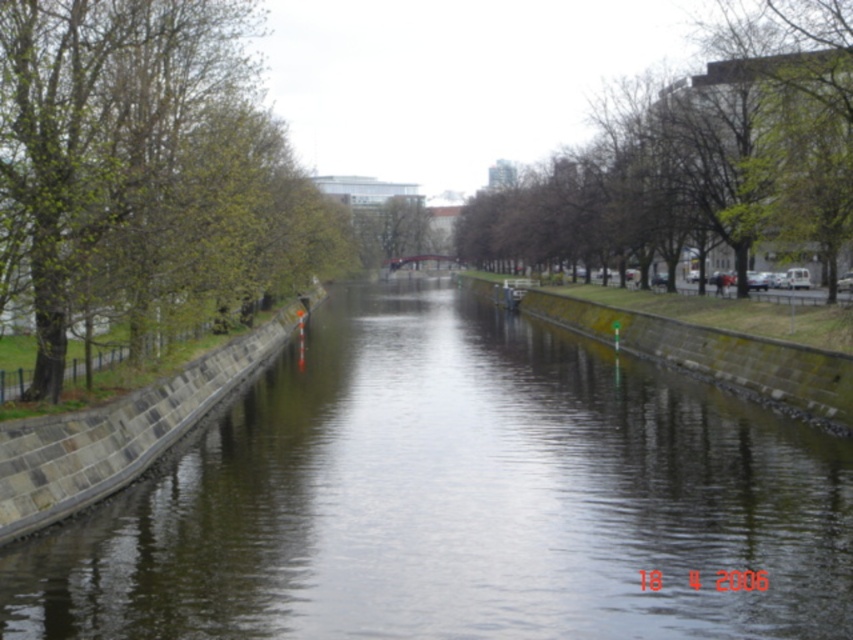
Is smooth concrete river at center to the left of green leafy tree at left from the viewer's perspective?

In fact, smooth concrete river at center is to the right of green leafy tree at left.

Can you confirm if smooth concrete river at center is positioned to the right of green leafy tree at left?

Correct, you'll find smooth concrete river at center to the right of green leafy tree at left.

Between point (210, 563) and point (77, 99), which one is positioned in front?

Positioned in front is point (210, 563).

Where is `smooth concrete river at center`? Image resolution: width=853 pixels, height=640 pixels. smooth concrete river at center is located at coordinates (457, 499).

Does smooth concrete river at center have a greater width compared to green leafy tree at upper center?

No.

Who is positioned more to the left, smooth concrete river at center or green leafy tree at upper center?

From the viewer's perspective, smooth concrete river at center appears more on the left side.

Is point (154, 570) positioned in front of point (631, 186)?

Yes, point (154, 570) is closer to viewer.

At what (x,y) coordinates should I click in order to perform the action: click on smooth concrete river at center. Please return your answer as a coordinate pair (x, y). Looking at the image, I should click on (457, 499).

Between green leafy tree at left and green leafy tree at upper center, which one has more height?

green leafy tree at upper center

Identify the location of green leafy tree at left. (146, 164).